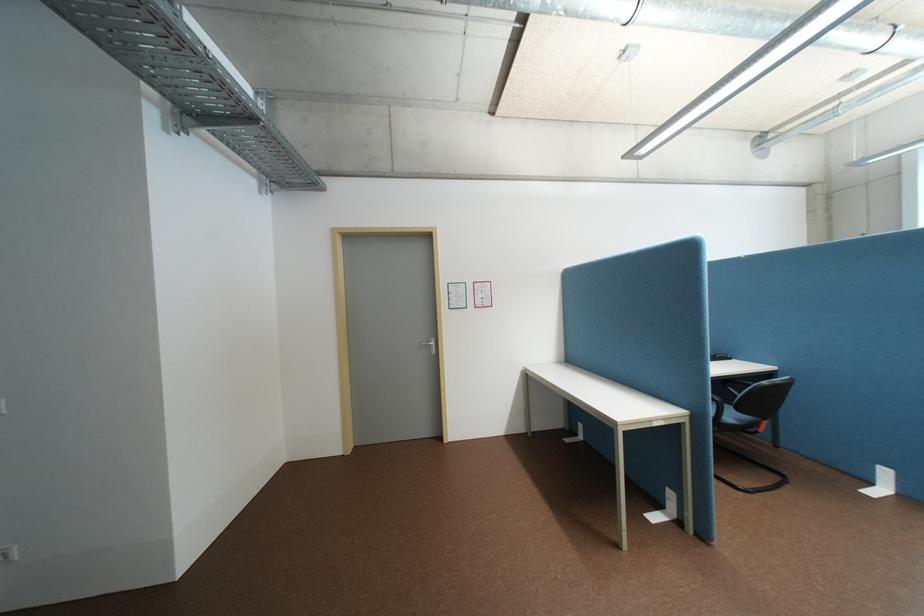
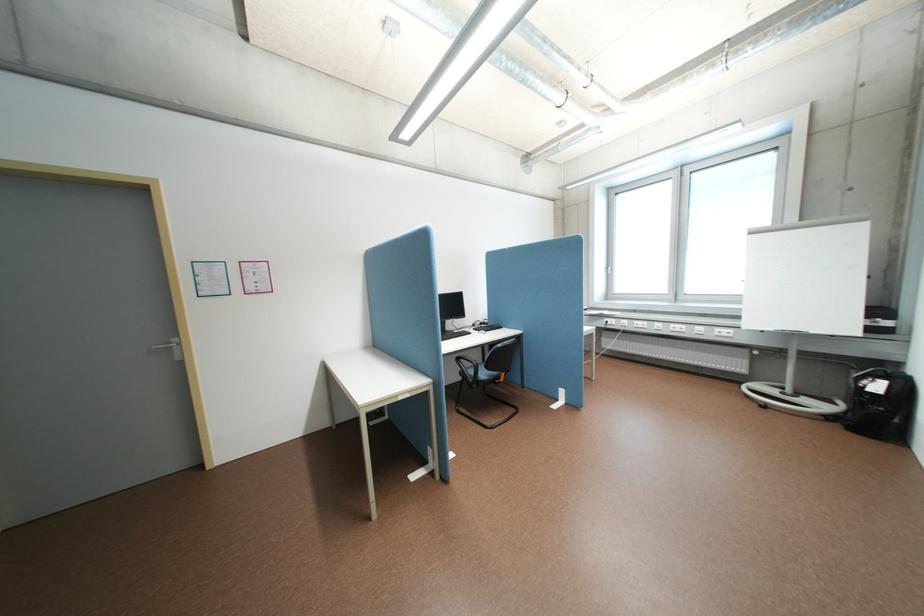
Find the pixel in the second image that matches point 743,416 in the first image.

(494, 374)